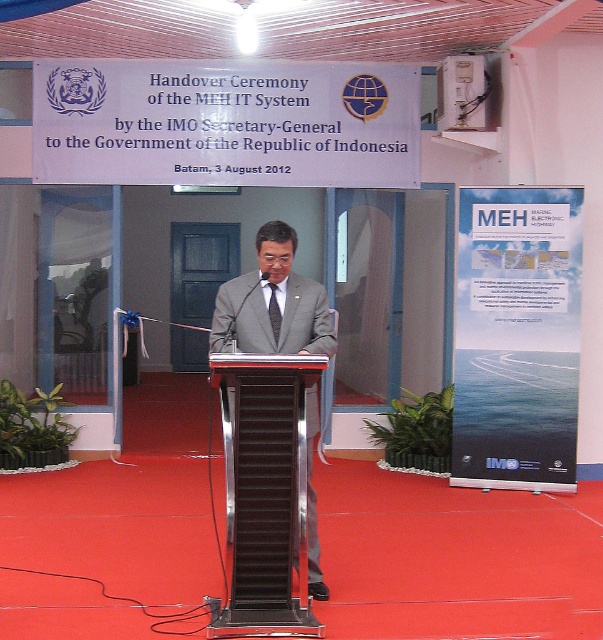
Based on the scene description, which object is taller between the blue paperboard poster at center and the gray suit at center?

The blue paperboard poster at center is taller than the gray suit at center according to the description.

You are an event photographer standing behind the podium. You need to capture a photo of the blue paperboard poster at center and the black textured tie at center in the same frame. Given that your camera has a maximum focus range of 3 meters, will you be able to capture both objects clearly in one shot?

A: The distance between the blue paperboard poster at center and the black textured tie at center is 3.28 meters. Since the camera can only focus up to 3 meters, the objects are too far apart for the camera to capture both clearly in the same frame.

You are attending the handover ceremony and want to take a photo of the gray suit at center. If your camera has a maximum focus range of 15 feet, will you be able to capture a clear photo?

The gray suit at center is 15.19 feet away from viewer. Since the distance exceeds the camera maximum focus range of 15 feet, the camera will not be able to focus properly and the photo will be blurry.